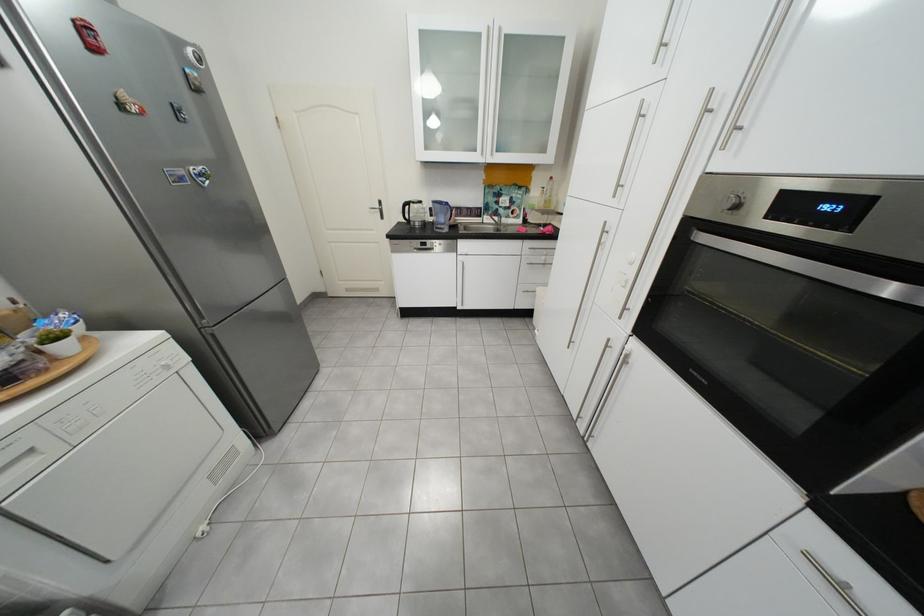
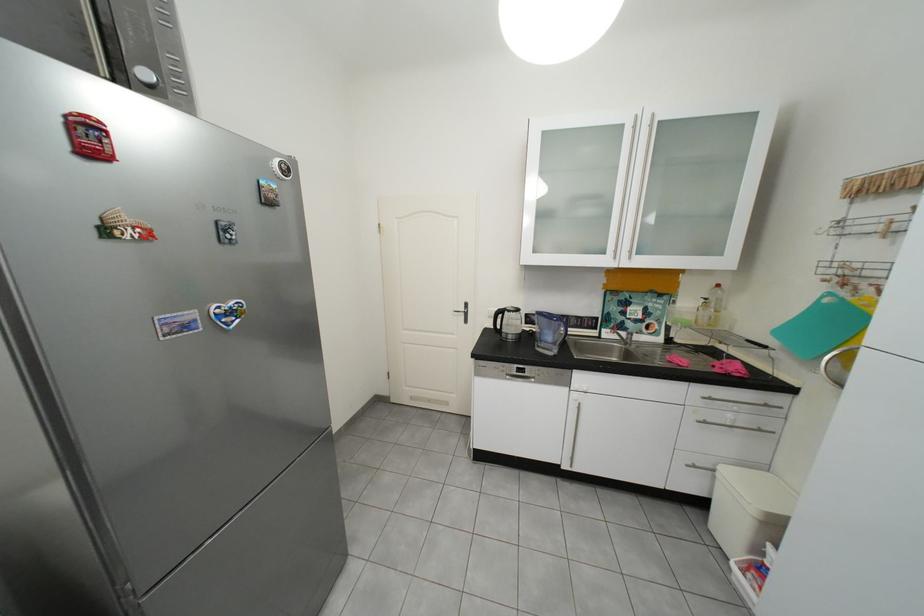
Where in the second image is the point corresponding to point 539,293 from the first image?

(707, 468)